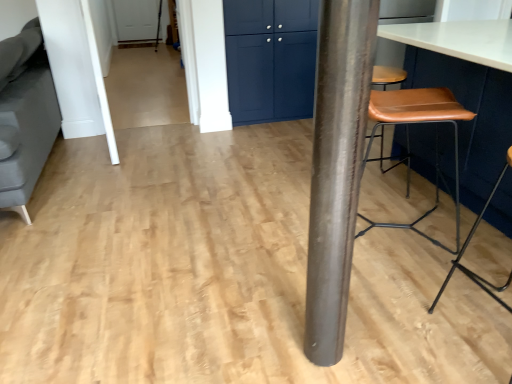
At what (x,y) coordinates should I click in order to perform the action: click on free location to the left of shiny metallic pole at center. Please return your answer as a coordinate pair (x, y). The image size is (512, 384). Looking at the image, I should click on (272, 347).